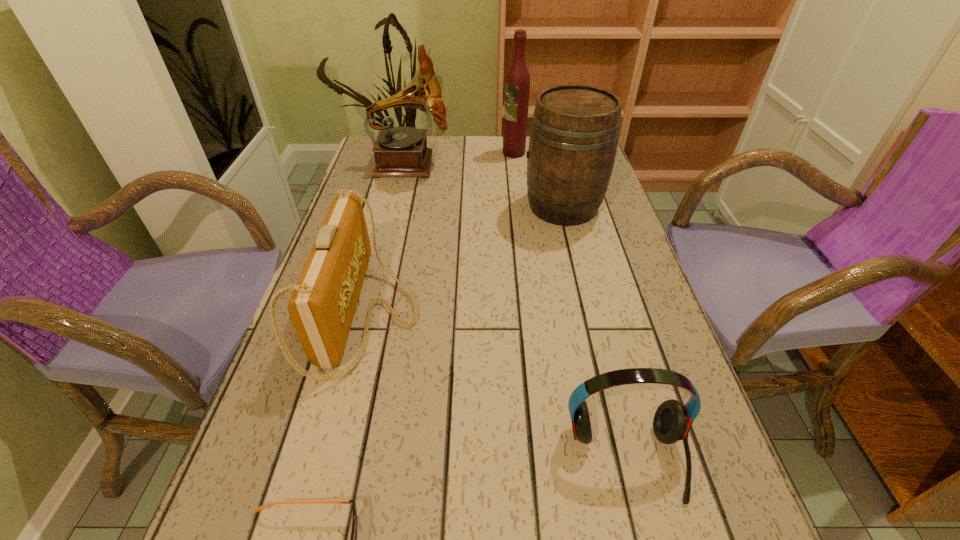
In order to click on cider present at the right edge in this screenshot , I will do `click(574, 134)`.

Identify the location of headset that is at the right edge. This screenshot has height=540, width=960. (672, 420).

This screenshot has width=960, height=540. Find the location of `object that is at the far left corner`. object that is at the far left corner is located at coordinates (401, 152).

Where is `free location at the far edge`? Image resolution: width=960 pixels, height=540 pixels. free location at the far edge is located at coordinates (479, 156).

Locate an element on the screen. The height and width of the screenshot is (540, 960). vacant area at the left edge is located at coordinates (403, 186).

Identify the location of vacant area at the right edge. The height and width of the screenshot is (540, 960). (571, 241).

In the image, there is a desktop. Where is `vacant space at the far left corner`? vacant space at the far left corner is located at coordinates (369, 154).

Find the location of a particular element. vacant space that's between the second nearest object and the phonograph_record is located at coordinates (518, 312).

What are the coordinates of `free spot between the cider and the third shortest object` in the screenshot? It's located at (465, 261).

You are a GUI agent. You are given a task and a screenshot of the screen. Output one action in this format:
    pyautogui.click(x=<x>, y=<y>)
    Task: Click on the empty space between the headset and the third farthest object
    
    Given the screenshot: What is the action you would take?
    pyautogui.click(x=594, y=333)